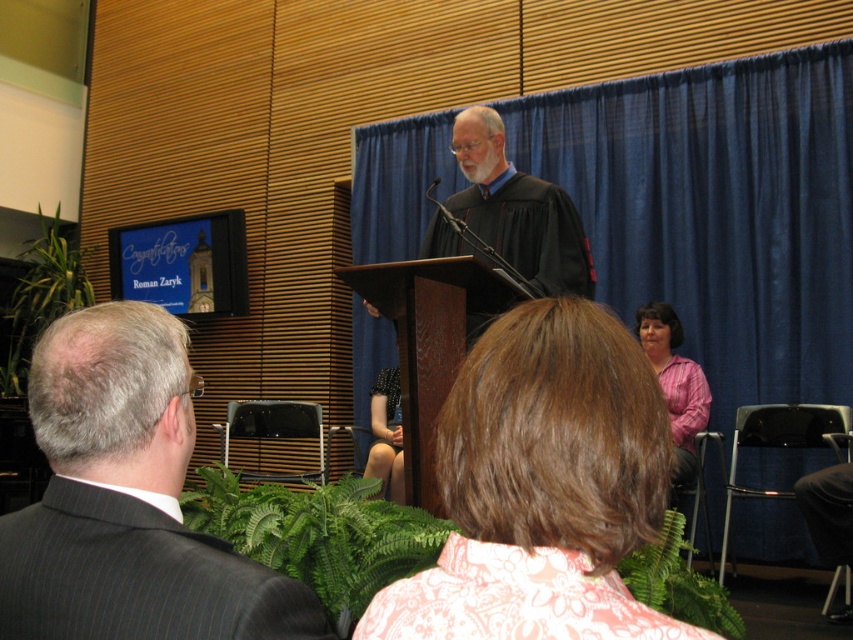
Can you confirm if blue fabric curtain at upper center is positioned to the right of black pinstripe suit at lower left?

Indeed, blue fabric curtain at upper center is positioned on the right side of black pinstripe suit at lower left.

Between point (733, 161) and point (77, 609), which one is positioned behind?

Point (733, 161)

I want to click on blue fabric curtain at upper center, so click(x=717, y=211).

Find the location of a particular element. The width and height of the screenshot is (853, 640). blue fabric curtain at upper center is located at coordinates (717, 211).

Based on the photo, does black pinstripe suit at left have a lesser width compared to pink shirt at lower right?

No.

Is point (74, 516) more distant than point (670, 372)?

No, (74, 516) is in front of (670, 372).

At what (x,y) coordinates should I click in order to perform the action: click on black pinstripe suit at left. Please return your answer as a coordinate pair (x, y). The width and height of the screenshot is (853, 640). Looking at the image, I should click on click(x=126, y=500).

Who is more forward, (683, 305) or (692, 417)?

Positioned in front is point (692, 417).

Between blue fabric curtain at upper center and pink shirt at lower right, which one is positioned higher?

blue fabric curtain at upper center

The width and height of the screenshot is (853, 640). Describe the element at coordinates (717, 211) in the screenshot. I see `blue fabric curtain at upper center` at that location.

Locate an element on the screen. The image size is (853, 640). blue fabric curtain at upper center is located at coordinates (717, 211).